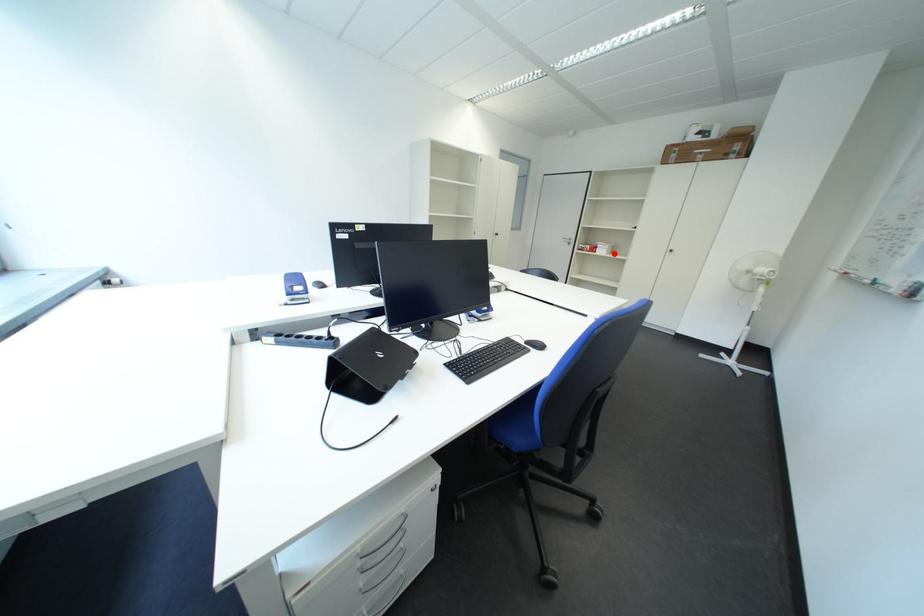
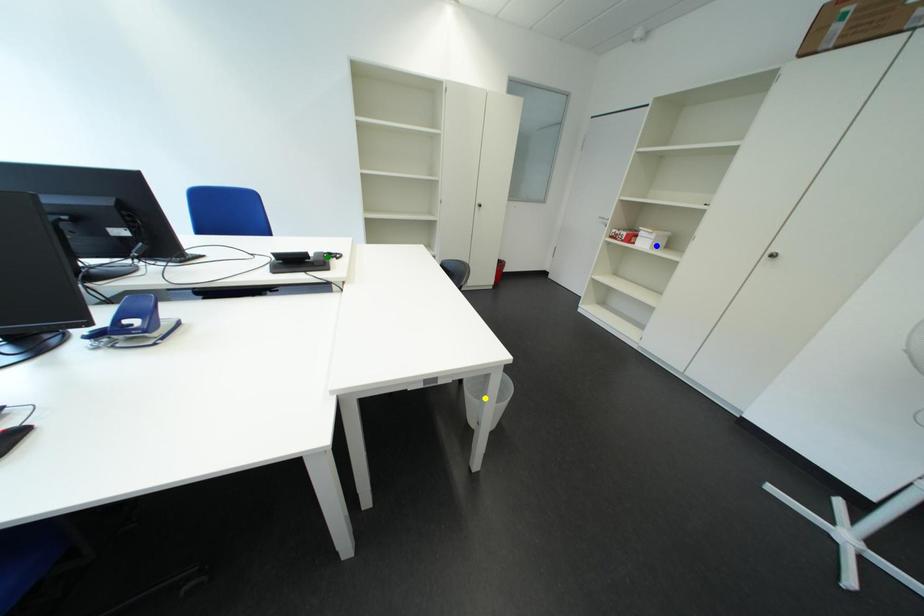
Question: I am providing you with two images of the same scene from different viewpoints. A red point is marked on the first image. You are given multiple points on the second image. Can you choose the point in image 2 that corresponds to the point in image 1?

Choices:
 (A) blue point
 (B) green point
 (C) yellow point

Answer: (A)